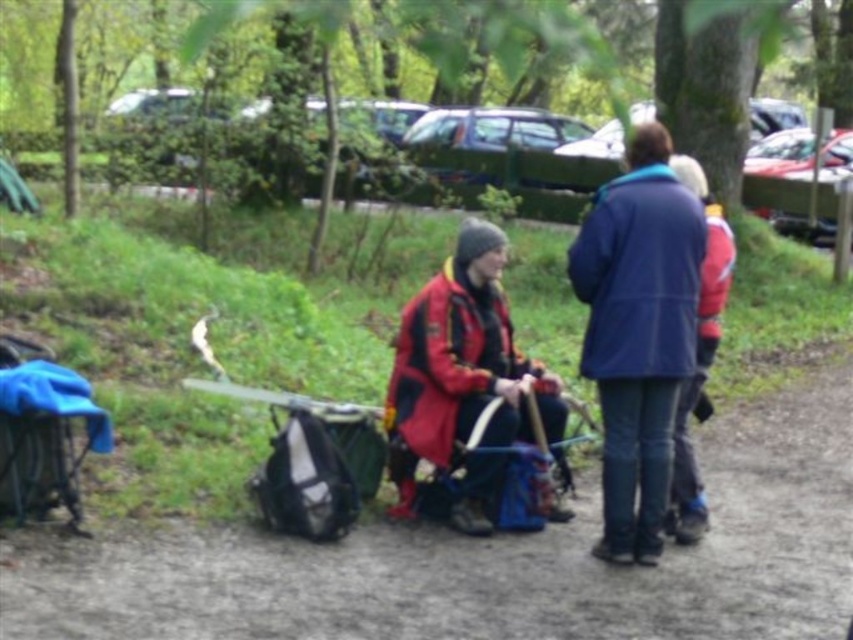
Question: From the image, what is the correct spatial relationship of dirt ground at center in relation to red matte jacket at center?

Choices:
 (A) left
 (B) right

Answer: (A)

Question: Is dirt ground at center closer to camera compared to red matte jacket at center?

Choices:
 (A) yes
 (B) no

Answer: (A)

Question: Which point is closer to the camera?

Choices:
 (A) red matte jacket at center
 (B) blue fabric coat at upper right
 (C) dirt ground at center

Answer: (C)

Question: Which point is farther from the camera taking this photo?

Choices:
 (A) (664, 186)
 (B) (599, 512)

Answer: (B)

Question: Which point appears closest to the camera in this image?

Choices:
 (A) (212, 579)
 (B) (614, 424)
 (C) (460, 339)

Answer: (A)

Question: Does dirt ground at center appear over red matte jacket at center?

Choices:
 (A) yes
 (B) no

Answer: (B)